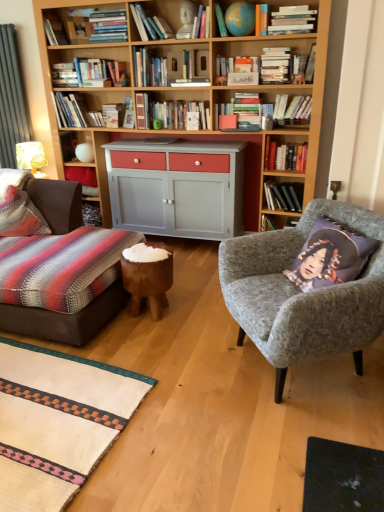
You are a GUI agent. You are given a task and a screenshot of the screen. Output one action in this format:
    pyautogui.click(x=<x>, y=<y>)
    Task: Click on the empty space that is ontop of white matte book at upper center, arranged as the 12th book when viewed from the left
    The width and height of the screenshot is (384, 512).
    Given the screenshot: What is the action you would take?
    pyautogui.click(x=305, y=0)